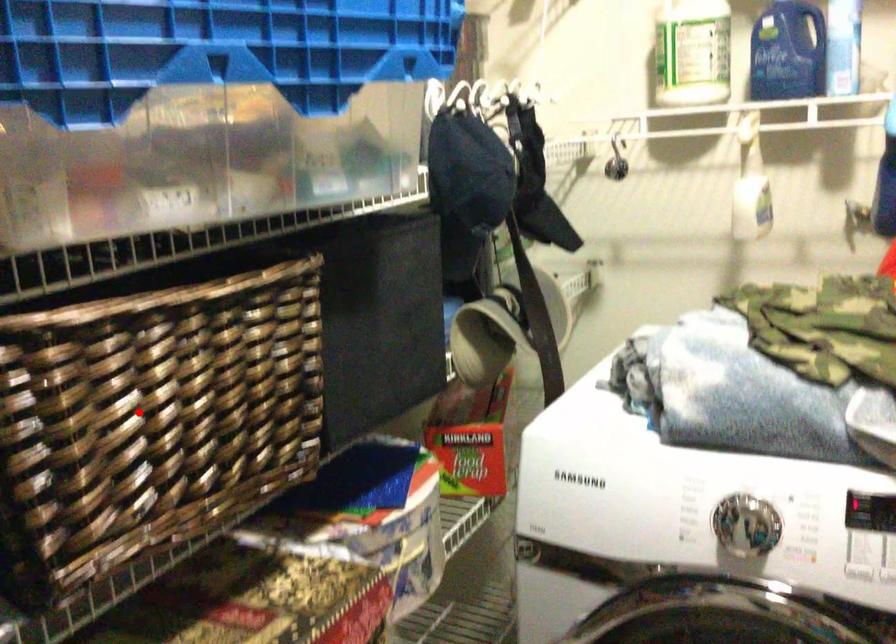
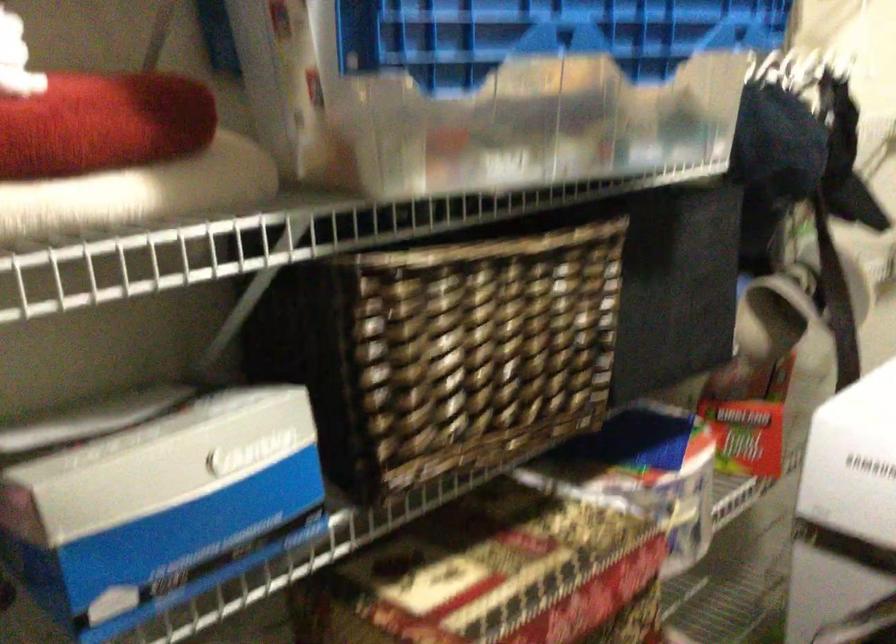
Question: I am providing you with two images of the same scene from different viewpoints. A red point is shown in image1. For the corresponding object point in image2, is it positioned nearer or farther from the camera?

Choices:
 (A) Nearer
 (B) Farther

Answer: (B)